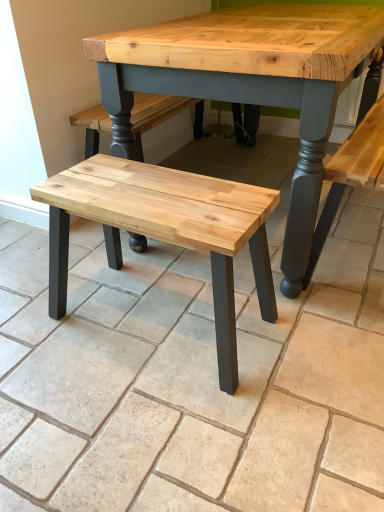
At what (x,y) coordinates should I click in order to perform the action: click on vacant region in front of natural wood stool at center. Please return your answer as a coordinate pair (x, y). Looking at the image, I should click on (165, 428).